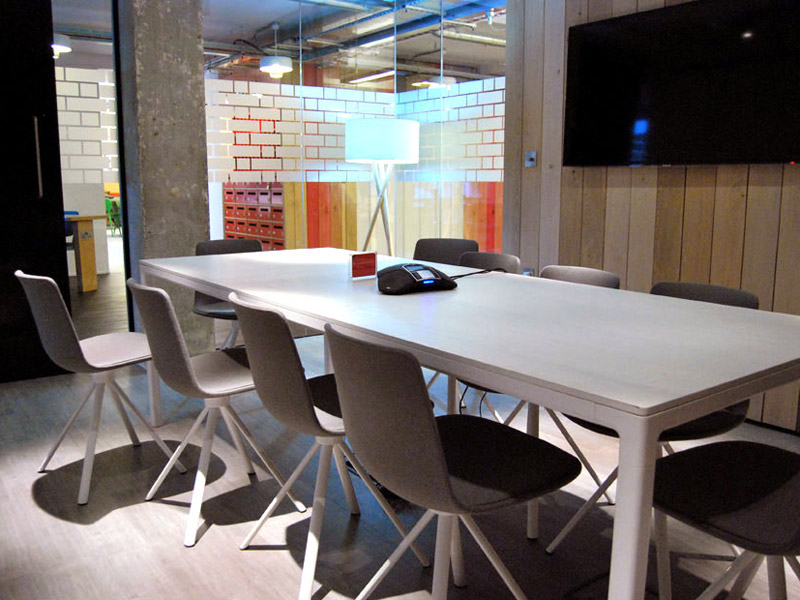
Where is `table legs`? This screenshot has height=600, width=800. table legs is located at coordinates pyautogui.click(x=646, y=503), pyautogui.click(x=149, y=400), pyautogui.click(x=324, y=351).